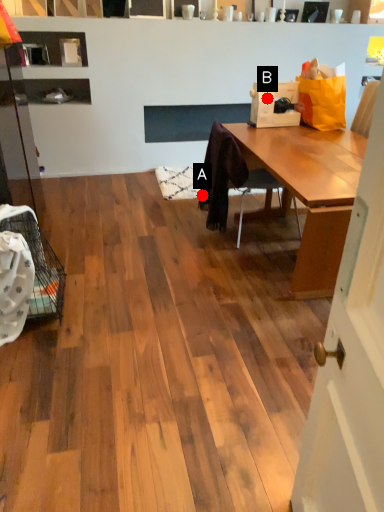
Question: Two points are circled on the image, labeled by A and B beside each circle. Among these points, which one is farthest from the camera?

Choices:
 (A) A is further
 (B) B is further

Answer: (A)